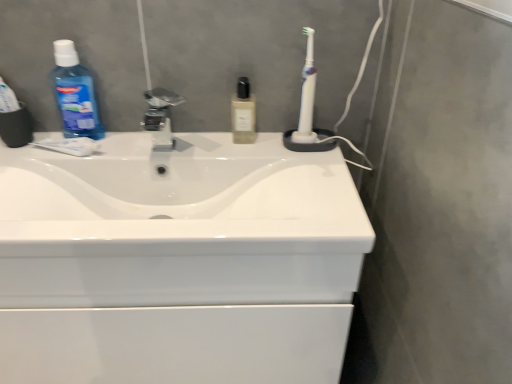
Image resolution: width=512 pixels, height=384 pixels. What are the coordinates of `vacant space that's between translucent glass bottle at center and blue translucent mouthwash at left` in the screenshot? It's located at (165, 136).